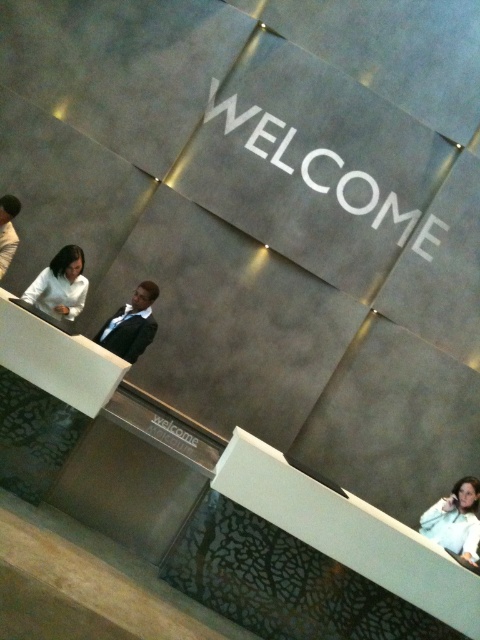
Can you confirm if white matte jacket at lower right is positioned above matte white blouse at left?

Actually, white matte jacket at lower right is below matte white blouse at left.

Image resolution: width=480 pixels, height=640 pixels. I want to click on white matte jacket at lower right, so click(x=455, y=520).

Is matte white blouse at left in front of black suit at center?

Yes, matte white blouse at left is in front of black suit at center.

Can you confirm if matte white blouse at left is thinner than black suit at center?

Correct, matte white blouse at left's width is less than black suit at center's.

Identify the location of matte white blouse at left. (60, 285).

At what (x,y) coordinates should I click in order to perform the action: click on matte white blouse at left. Please return your answer as a coordinate pair (x, y). This screenshot has width=480, height=640. Looking at the image, I should click on (60, 285).

Which is more to the right, white matte jacket at lower right or black suit at center?

From the viewer's perspective, white matte jacket at lower right appears more on the right side.

Can you confirm if white matte jacket at lower right is positioned to the right of black suit at center?

Yes, white matte jacket at lower right is to the right of black suit at center.

Between point (454, 525) and point (129, 348), which one is positioned in front?

Point (454, 525) is more forward.

Identify the location of white matte jacket at lower right. Image resolution: width=480 pixels, height=640 pixels. click(455, 520).